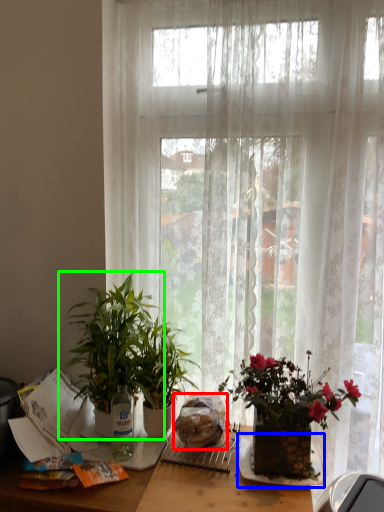
Question: Estimate the real-world distances between objects in this image. Which object is closer to food (highlighted by a red box), plate (highlighted by a blue box) or houseplant (highlighted by a green box)?

Choices:
 (A) plate
 (B) houseplant

Answer: (A)